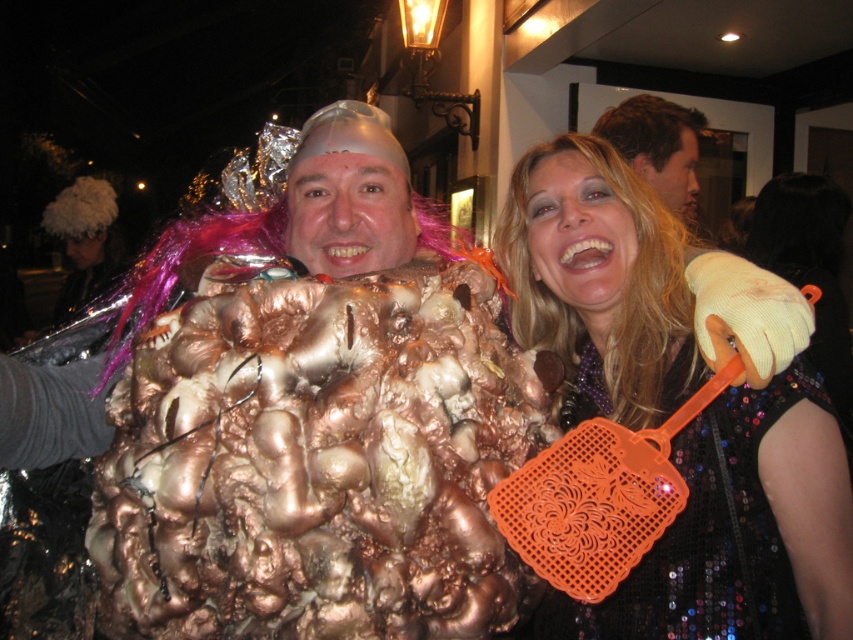
Is point (627, 356) positioned in front of point (664, 188)?

Yes, point (627, 356) is closer to viewer.

Can you confirm if blonde synthetic wig at upper right is thinner than shiny gold costume at center?

Correct, blonde synthetic wig at upper right's width is less than shiny gold costume at center's.

Who is more distant from viewer, (664, 369) or (624, 157)?

Point (624, 157)

I want to click on blonde synthetic wig at upper right, so click(x=622, y=291).

Does orange plastic flyswatter at right lie behind blonde synthetic wig at upper right?

No.

Does orange plastic flyswatter at right have a greater height compared to blonde synthetic wig at upper right?

Correct, orange plastic flyswatter at right is much taller as blonde synthetic wig at upper right.

Between point (753, 621) and point (674, 280), which one is positioned in front?

Point (753, 621) is in front.

Identify the location of orange plastic flyswatter at right. Image resolution: width=853 pixels, height=640 pixels. click(x=740, y=529).

Is point (749, 628) positioned after point (653, 177)?

No, it is in front of (653, 177).

Which is above, orange plastic flyswatter at right or shiny gold costume at center?

shiny gold costume at center

Find the location of a particular element. orange plastic flyswatter at right is located at coordinates (740, 529).

Where is `orange plastic flyswatter at right`? The width and height of the screenshot is (853, 640). orange plastic flyswatter at right is located at coordinates (740, 529).